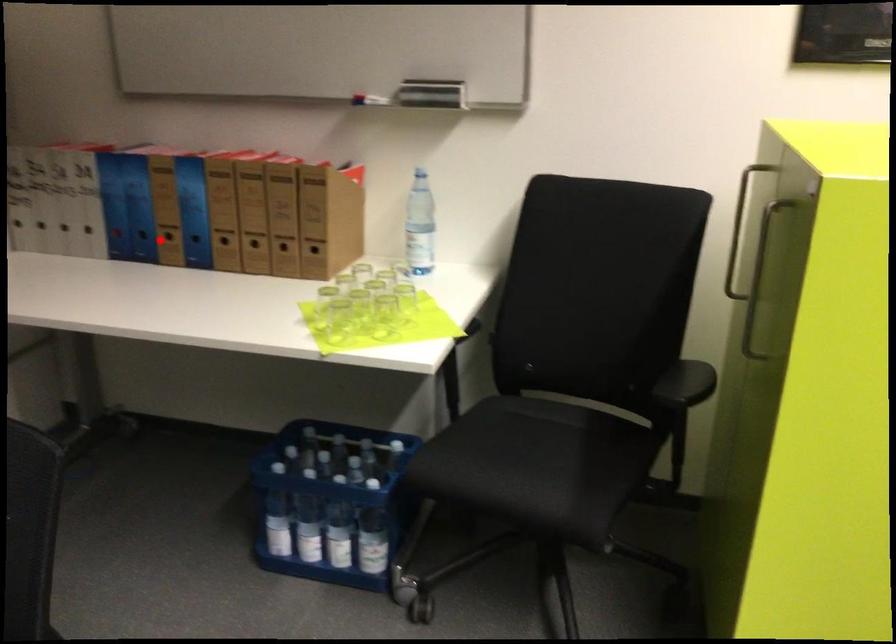
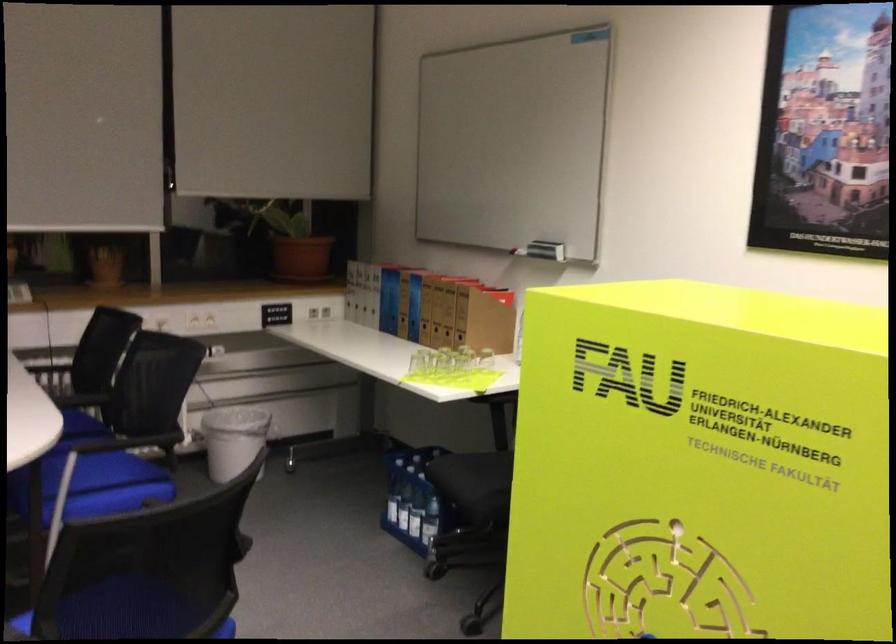
Question: I am providing you with two images of the same scene from different viewpoints. Given a red point in image1, look at the same physical point in image2. Is it:

Choices:
 (A) Closer to the viewpoint
 (B) Farther from the viewpoint

Answer: (B)